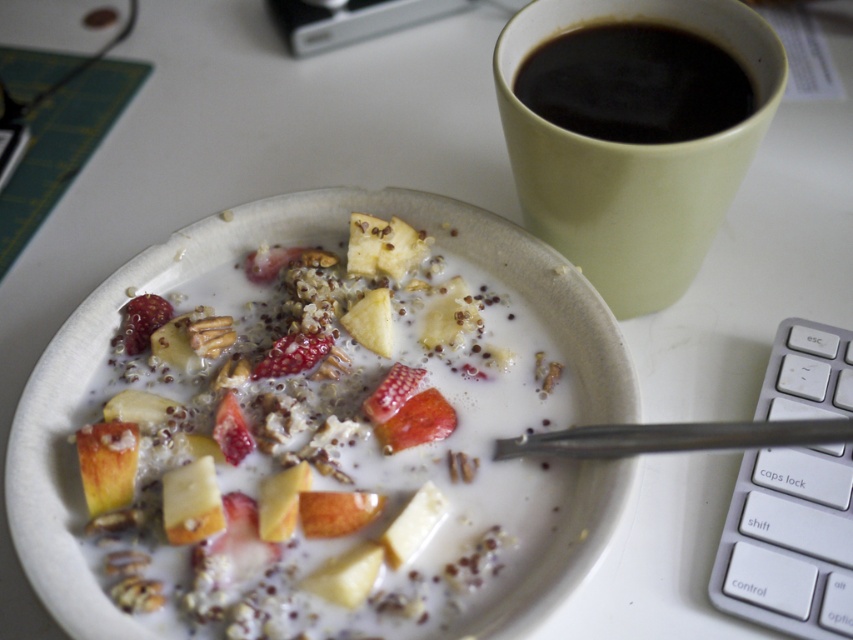
Question: Is matte green cup at upper right in front of black matte cup at upper right?

Choices:
 (A) no
 (B) yes

Answer: (B)

Question: Can you confirm if matte green cup at upper right is thinner than black matte cup at upper right?

Choices:
 (A) no
 (B) yes

Answer: (A)

Question: Is the position of matte green cup at upper right less distant than that of black matte cup at upper right?

Choices:
 (A) no
 (B) yes

Answer: (B)

Question: Which point is closer to the camera?

Choices:
 (A) black matte cup at upper right
 (B) matte green cup at upper right

Answer: (B)

Question: Which point is farther from the camera taking this photo?

Choices:
 (A) (675, 4)
 (B) (527, 60)

Answer: (A)

Question: Which point is closer to the camera?

Choices:
 (A) (662, 49)
 (B) (660, 188)

Answer: (B)